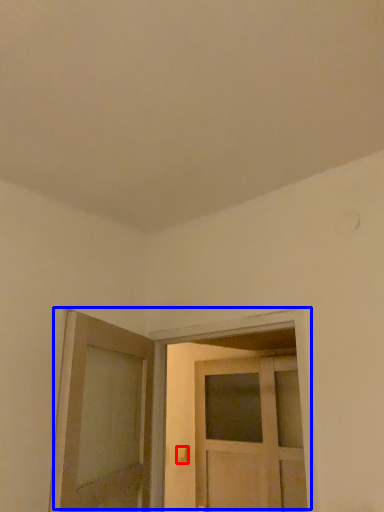
Question: Which object is further to the camera taking this photo, door handle (highlighted by a red box) or door (highlighted by a blue box)?

Choices:
 (A) door handle
 (B) door

Answer: (A)